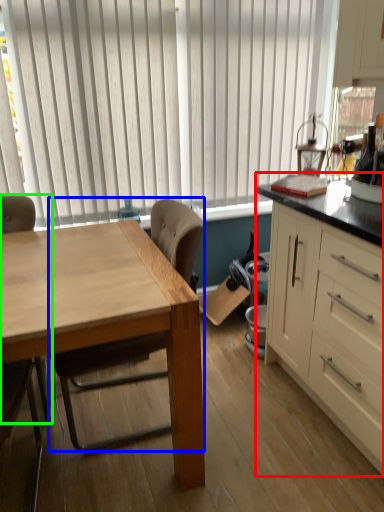
Question: Which object is the farthest from cabinetry (highlighted by a red box)? Choose among these: chair (highlighted by a blue box) or chair (highlighted by a green box).

Choices:
 (A) chair
 (B) chair

Answer: (B)